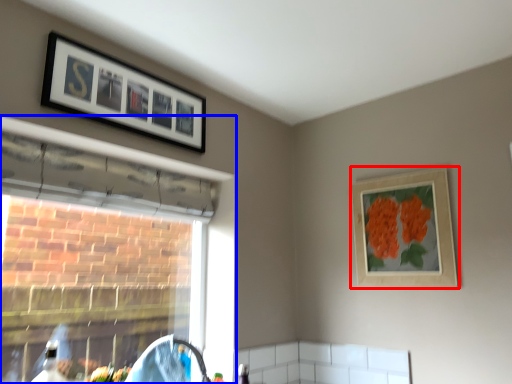
Question: Which point is further to the camera, picture frame (highlighted by a red box) or window (highlighted by a blue box)?

Choices:
 (A) picture frame
 (B) window

Answer: (A)